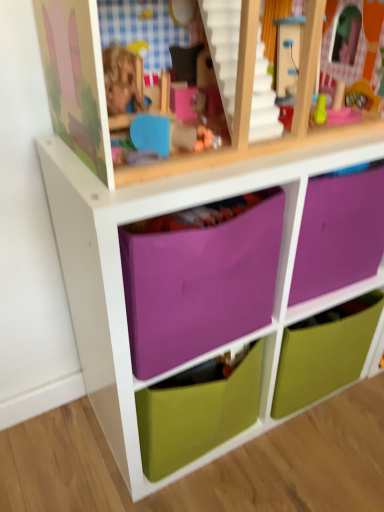
Question: Does purple fabric drawer at center, acting as the 2th drawer starting from the top, have a lesser width compared to green matte drawer at center, which appears as the first drawer when ordered from the bottom?

Choices:
 (A) yes
 (B) no

Answer: (B)

Question: Considering the relative positions of purple fabric drawer at center, acting as the 2th drawer starting from the top, and green matte drawer at center, which is the 3th drawer in top-to-bottom order, in the image provided, is purple fabric drawer at center, acting as the 2th drawer starting from the top, to the left of green matte drawer at center, which is the 3th drawer in top-to-bottom order, from the viewer's perspective?

Choices:
 (A) no
 (B) yes

Answer: (B)

Question: Does purple fabric drawer at center, acting as the second drawer starting from the bottom, appear on the right side of green matte drawer at center, which is the 3th drawer in top-to-bottom order?

Choices:
 (A) no
 (B) yes

Answer: (A)

Question: Does purple fabric drawer at center, acting as the 2th drawer starting from the top, have a smaller size compared to green matte drawer at center, which is the 3th drawer in top-to-bottom order?

Choices:
 (A) yes
 (B) no

Answer: (B)

Question: From a real-world perspective, is purple fabric drawer at center, acting as the second drawer starting from the bottom, located higher than green matte drawer at center, which is the 3th drawer in top-to-bottom order?

Choices:
 (A) yes
 (B) no

Answer: (A)

Question: Looking at their shapes, would you say green matte drawer at center, which appears as the first drawer when ordered from the bottom, is wider or thinner than purple fabric drawer at center, acting as the 2th drawer starting from the top?

Choices:
 (A) thin
 (B) wide

Answer: (A)

Question: Is green matte drawer at center, which is the 3th drawer in top-to-bottom order, situated inside purple fabric drawer at center, acting as the second drawer starting from the bottom, or outside?

Choices:
 (A) outside
 (B) inside

Answer: (B)

Question: In the image, is green matte drawer at center, which is the 3th drawer in top-to-bottom order, positioned in front of or behind purple fabric drawer at center, acting as the 2th drawer starting from the top?

Choices:
 (A) front
 (B) behind

Answer: (B)

Question: From a real-world perspective, is green matte drawer at center, which is the 3th drawer in top-to-bottom order, physically located above or below purple fabric drawer at center, acting as the second drawer starting from the bottom?

Choices:
 (A) above
 (B) below

Answer: (B)

Question: Would you say green matte drawer at center, which is the 3th drawer in top-to-bottom order, is inside or outside purple fabric drawer at center, marked as the third drawer in a bottom-to-top arrangement?

Choices:
 (A) inside
 (B) outside

Answer: (B)

Question: Considering the positions of green matte drawer at center, which is the 3th drawer in top-to-bottom order, and purple fabric drawer at center, marked as the third drawer in a bottom-to-top arrangement, in the image, is green matte drawer at center, which is the 3th drawer in top-to-bottom order, taller or shorter than purple fabric drawer at center, marked as the third drawer in a bottom-to-top arrangement,?

Choices:
 (A) tall
 (B) short

Answer: (A)

Question: Is point (283, 368) closer or farther from the camera than point (243, 210)?

Choices:
 (A) closer
 (B) farther

Answer: (B)

Question: Considering their positions, is green matte drawer at center, which appears as the first drawer when ordered from the bottom, located in front of or behind purple fabric drawer at center, marked as the third drawer in a bottom-to-top arrangement?

Choices:
 (A) behind
 (B) front

Answer: (A)

Question: Is point (223, 271) closer or farther from the camera than point (281, 357)?

Choices:
 (A) closer
 (B) farther

Answer: (A)

Question: From the image's perspective, is purple fabric drawer at center, acting as the second drawer starting from the bottom, positioned above or below green matte drawer at center, which is the 3th drawer in top-to-bottom order?

Choices:
 (A) above
 (B) below

Answer: (A)